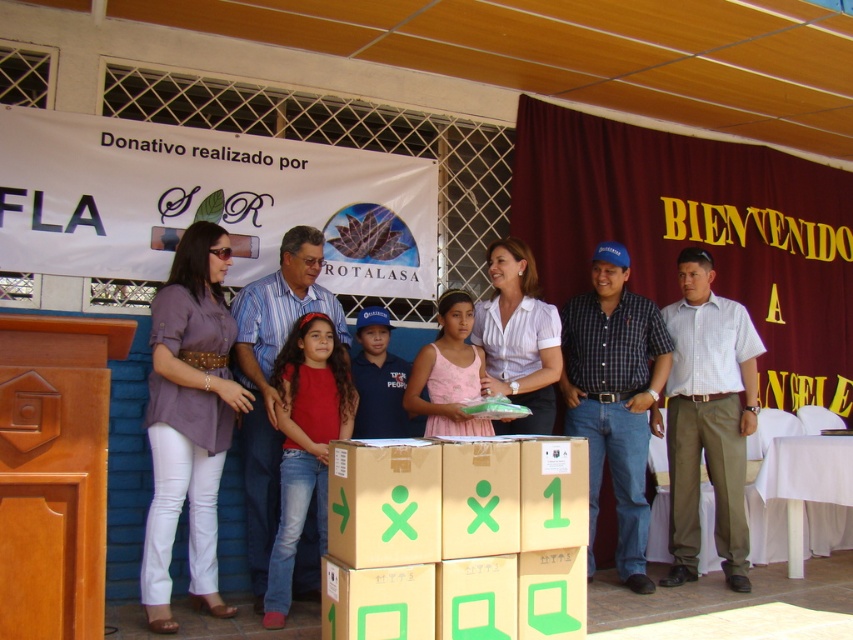
You are organizing the donated items and need to place the brown cardboard box at center and the white checkered shirt at right into storage. Which item requires a wider storage space?

The brown cardboard box at center requires a wider storage space since its width surpasses that of the white checkered shirt at right.

You are a photographer at the event and want to ensure both the blue plaid shirt at center and the blue denim jeans at center are clearly visible in your photo. Based on their positions, which one might require more space in the frame to avoid being cropped?

The blue plaid shirt at center might require more space in the frame because it is wider than the blue denim jeans at center according to the description.